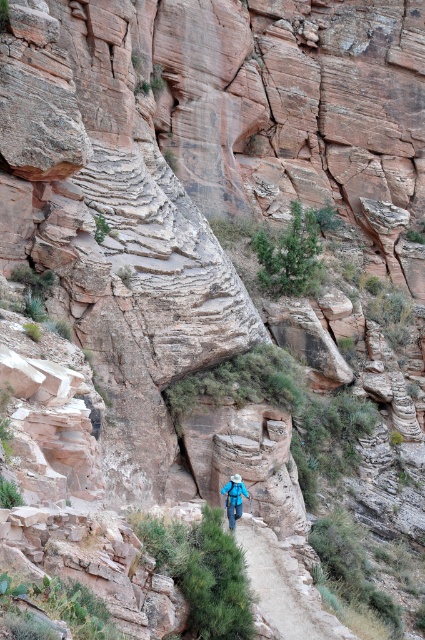
Question: Considering the relative positions of dirt path at center and blue fabric backpack at center in the image provided, where is dirt path at center located with respect to blue fabric backpack at center?

Choices:
 (A) left
 (B) right

Answer: (B)

Question: Which point is farther to the camera?

Choices:
 (A) blue fabric backpack at center
 (B) dirt path at center

Answer: (A)

Question: Does dirt path at center have a lesser width compared to blue fabric backpack at center?

Choices:
 (A) no
 (B) yes

Answer: (A)

Question: Which object appears farthest from the camera in this image?

Choices:
 (A) blue fabric backpack at center
 (B) dirt path at center

Answer: (A)

Question: Considering the relative positions of dirt path at center and blue fabric backpack at center in the image provided, where is dirt path at center located with respect to blue fabric backpack at center?

Choices:
 (A) below
 (B) above

Answer: (A)